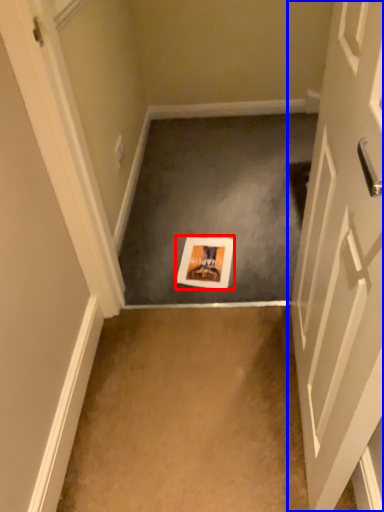
Question: Which point is further to the camera, postcard (highlighted by a red box) or door (highlighted by a blue box)?

Choices:
 (A) postcard
 (B) door

Answer: (A)